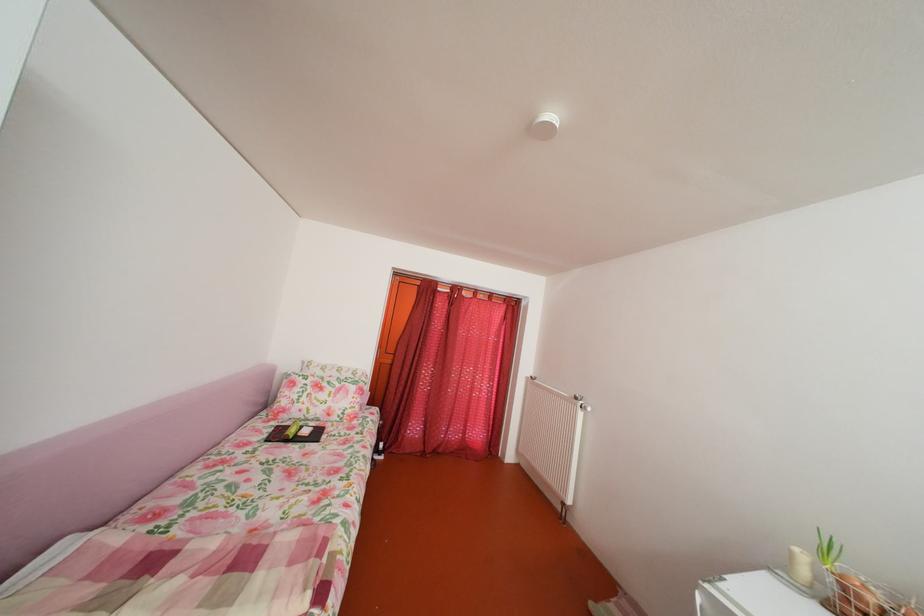
Find where to lift the metal wire basket. Please return your answer as a coordinate pair (x, y).

(864, 594)